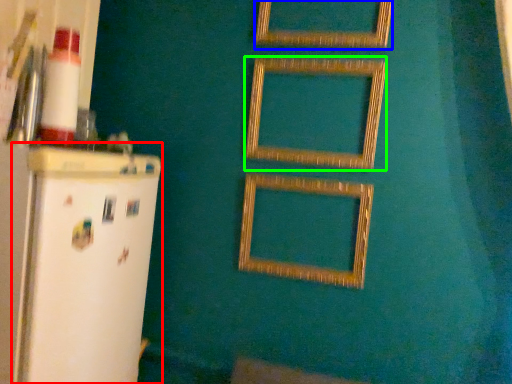
Question: Estimate the real-world distances between objects in this image. Which object is farther from fridge (highlighted by a red box), picture frame (highlighted by a blue box) or picture frame (highlighted by a green box)?

Choices:
 (A) picture frame
 (B) picture frame

Answer: (A)